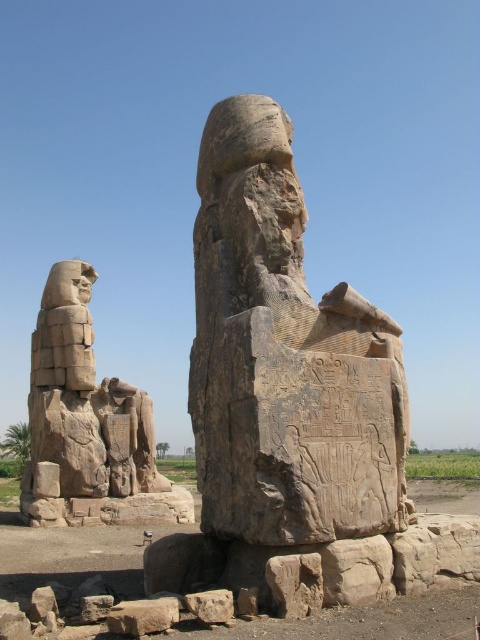
You are an archaeologist working at the site of these two ancient statues. You need to place a protective barrier between the gray stone at lower center and the rusty stone block at lower left. The barrier requires a minimum of 5 meters of space between them to be effective. Based on the scene, will the barrier work?

The gray stone at lower center is 5.14 meters from the rusty stone block at lower left. Since the required distance is 5 meters, the barrier will work as the distance is sufficient.

You are standing in front of the two colossal statues in the image. There is a point at coordinates (285, 356). Which statue does this point belong to?

The point at coordinates (285, 356) is on the granite statue at center.

You are an archaeologist examining the site. You need to access the rusty stone block at lower left to analyze its inscriptions. Is the granite statue at center blocking your direct path to it?

The granite statue at center is in front of the rusty stone block at lower left, so it is blocking the direct path to the rusty stone block at lower left.